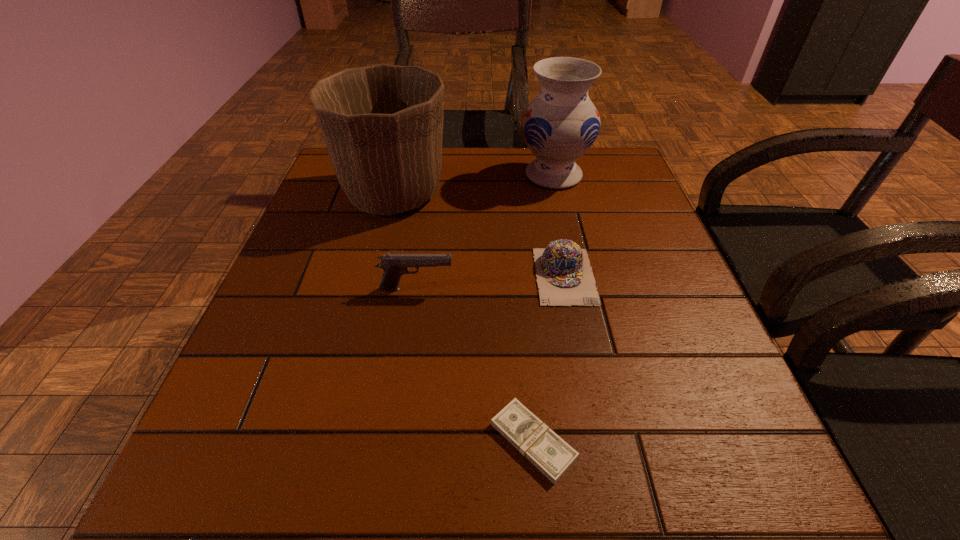
I want to click on free space in the image that satisfies the following two spatial constraints: 1. on the front, side, and top of the cap; 2. at the barrel of the third tallest object, so click(567, 289).